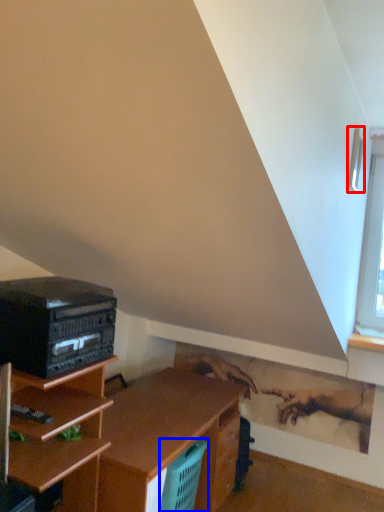
Question: Which of the following is the farthest to the observer, window (highlighted by a red box) or basket (highlighted by a blue box)?

Choices:
 (A) window
 (B) basket

Answer: (B)